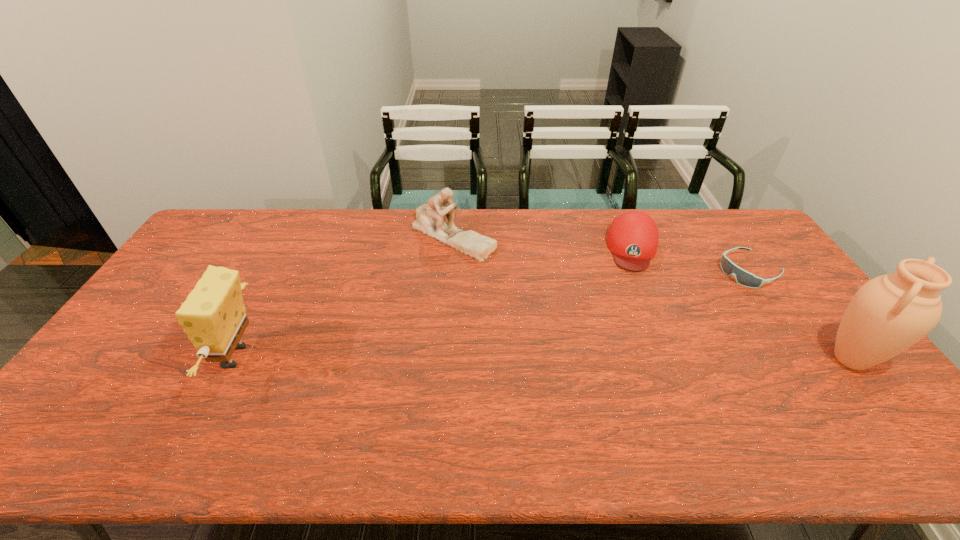
Find the location of a particular element. blank space at the left edge is located at coordinates (132, 375).

Locate an element on the screen. This screenshot has height=540, width=960. free space at the far left corner of the desktop is located at coordinates (265, 208).

This screenshot has height=540, width=960. Find the location of `vacant space at the far right corner of the desktop`. vacant space at the far right corner of the desktop is located at coordinates (749, 244).

Where is `free space between the sponge and the urn`? free space between the sponge and the urn is located at coordinates (543, 358).

Find the location of `empty location between the urn and the shortest object`. empty location between the urn and the shortest object is located at coordinates (801, 315).

You are a GUI agent. You are given a task and a screenshot of the screen. Output one action in this format:
    pyautogui.click(x=<x>, y=<y>)
    Task: Click on the free area in between the second shortest object and the urn
    
    Given the screenshot: What is the action you would take?
    pyautogui.click(x=742, y=303)

At what (x,y) coordinates should I click in order to perform the action: click on unoccupied position between the goggles and the sponge. Please return your answer as a coordinate pair (x, y). Image resolution: width=960 pixels, height=540 pixels. Looking at the image, I should click on (493, 314).

Identify the location of free point between the third object from left to right and the figurine. The width and height of the screenshot is (960, 540). (543, 242).

This screenshot has width=960, height=540. In order to click on free spot between the third tallest object and the sponge in this screenshot , I will do `click(345, 296)`.

Identify the location of free space between the sponge and the second shortest object. (435, 302).